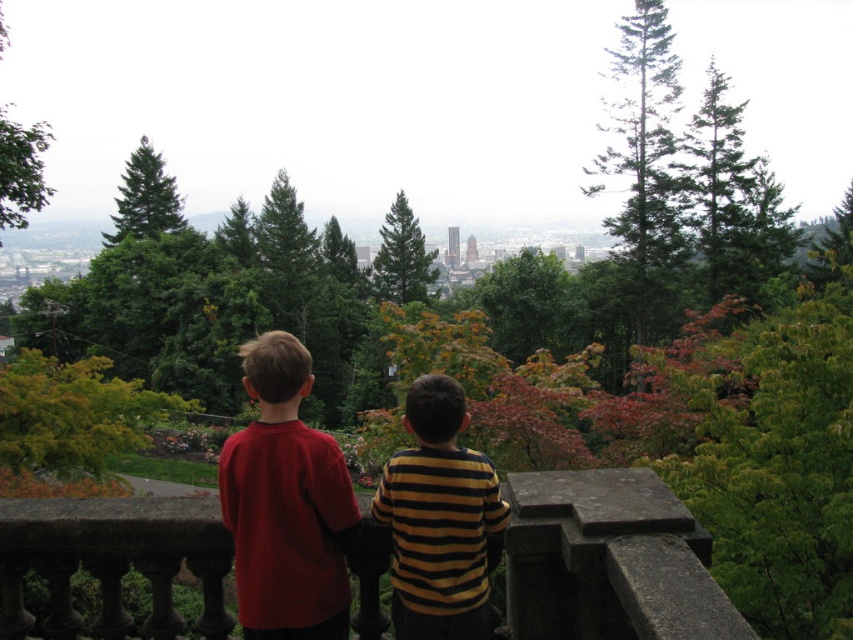
You are a photographer trying to capture a clear shot of the matte red shirt at center and the green leafy tree at upper left. However, you notice that one of these objects is blocking the other. Which object is closer to the camera, making it block the other?

The matte red shirt at center is in front of the green leafy tree at upper left, so it is closer to the camera and blocking the tree.

You are a photographer trying to capture a photo of the matte red shirt at center and the green leafy tree at upper left. Based on their positions, which object is closer to the camera?

The matte red shirt at center is closer to the camera because it is positioned below the green leafy tree at upper left, indicating it is in a lower plane relative to the camera.

You are standing at the edge of a stone railing overlooking a city. You need to determine if a drone can fly from your current position to a specific point marked at coordinates point (416, 237) without any obstacles. The drone has a maximum flight distance of 500 feet. Can the drone reach the point?

The distance of point (416, 237) from camera is 456.51 feet, which is within the drone maximum flight distance of 500 feet. The drone can reach the point.